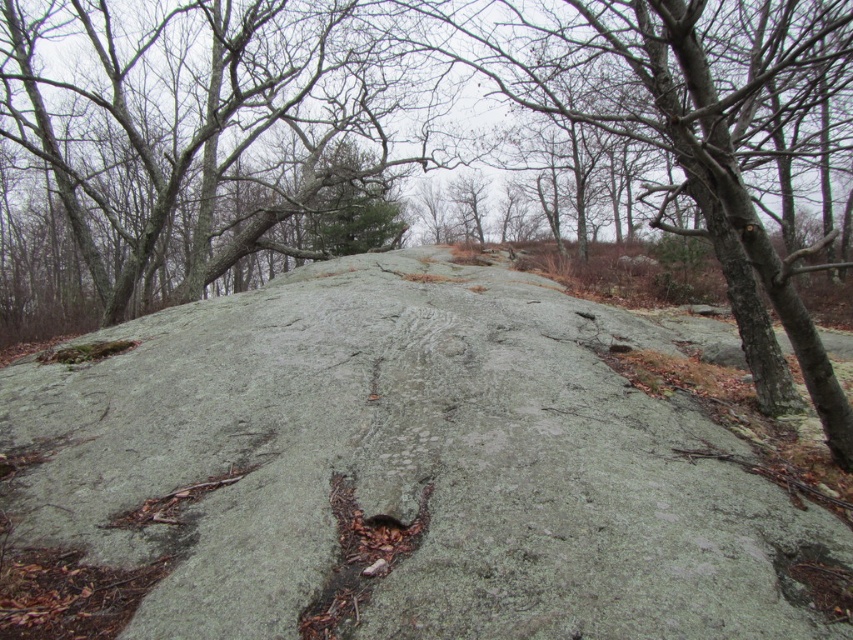
You are a hiker trying to determine which rock is wider between the gray rough rock at center and the green mossy rock at center. Based on the scene, which one has a greater width?

The green mossy rock at center has a greater width than the gray rough rock at center.

You are a hiker trying to navigate through the forest and see the gray rough rock at center and the green mossy rock at center. Which rock is closer to you?

The gray rough rock at center is closer to you because it is in front of the green mossy rock at center.

You are a hiker trying to determine the highest point between the gray rough rock at center and the green mossy rock at center. Which one should you climb to reach a higher elevation?

The green mossy rock at center is taller than the gray rough rock at center, so you should climb the green mossy rock at center to reach a higher elevation.